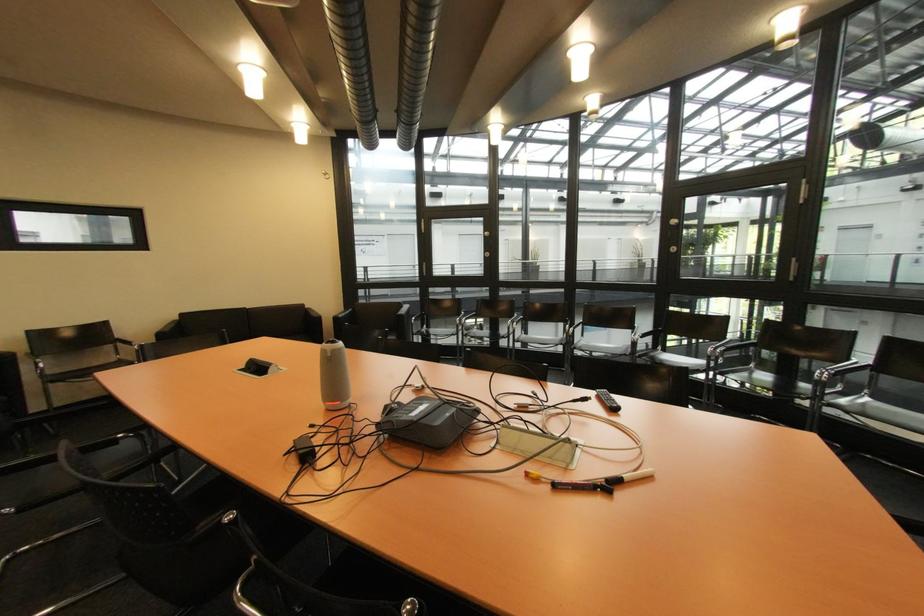
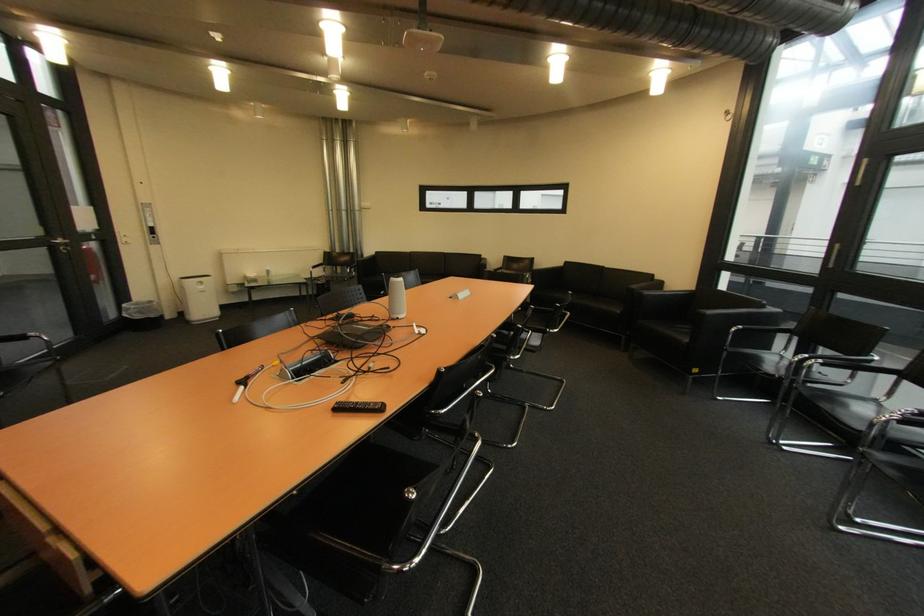
Locate, in the second image, the point that corresponds to point 410,315 in the first image.

(712, 315)